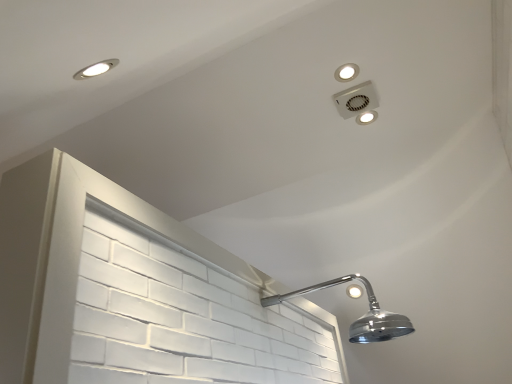
Question: Is matte white light fixture at upper right, the first dot viewed from the right, at the right side of white plastic light fixture at upper center, which is counted as the 2th dot, starting from the back?

Choices:
 (A) yes
 (B) no

Answer: (A)

Question: Is white plastic light fixture at upper center, acting as the 2th dot starting from the right, surrounded by matte white light fixture at upper right, which ranks as the second dot in top-to-bottom order?

Choices:
 (A) no
 (B) yes

Answer: (A)

Question: Is matte white light fixture at upper right, the second dot when ordered from front to back, looking in the opposite direction of white plastic light fixture at upper center, acting as the 2th dot starting from the right?

Choices:
 (A) no
 (B) yes

Answer: (A)

Question: Is matte white light fixture at upper right, the first dot viewed from the right, at the left side of white plastic light fixture at upper center, the first dot viewed from the left?

Choices:
 (A) yes
 (B) no

Answer: (B)

Question: Could you tell me if matte white light fixture at upper right, which ranks as the second dot in top-to-bottom order, is facing white plastic light fixture at upper center, which ranks as the 2th dot in bottom-to-top order?

Choices:
 (A) yes
 (B) no

Answer: (B)

Question: Considering their positions, is white plastic light fixture at upper center, which is the 1th dot in top-to-bottom order, located in front of or behind white plastic vent at upper right?

Choices:
 (A) front
 (B) behind

Answer: (A)

Question: Would you say white plastic light fixture at upper center, which ranks as the 2th dot in bottom-to-top order, is to the left or to the right of white plastic vent at upper right in the picture?

Choices:
 (A) right
 (B) left

Answer: (B)

Question: From the image's perspective, is white plastic light fixture at upper center, which is counted as the 2th dot, starting from the back, above or below white plastic vent at upper right?

Choices:
 (A) above
 (B) below

Answer: (A)

Question: From a real-world perspective, is white plastic light fixture at upper center, which ranks as the 2th dot in bottom-to-top order, positioned above or below white plastic vent at upper right?

Choices:
 (A) below
 (B) above

Answer: (B)

Question: Is matte white light fixture at upper right, the first dot viewed from the right, to the left or to the right of white plastic vent at upper right in the image?

Choices:
 (A) left
 (B) right

Answer: (B)

Question: Is matte white light fixture at upper right, which is counted as the second dot, starting from the left, in front of or behind white plastic vent at upper right in the image?

Choices:
 (A) behind
 (B) front

Answer: (A)

Question: From a real-world perspective, relative to white plastic vent at upper right, is matte white light fixture at upper right, the first dot viewed from the right, vertically above or below?

Choices:
 (A) above
 (B) below

Answer: (A)

Question: Is matte white light fixture at upper right, the first dot viewed from the right, situated inside white plastic vent at upper right or outside?

Choices:
 (A) inside
 (B) outside

Answer: (B)

Question: From a real-world perspective, is white plastic light fixture at upper center, which is counted as the 2th dot, starting from the back, above or below matte white light fixture at upper right, which ranks as the second dot in top-to-bottom order?

Choices:
 (A) above
 (B) below

Answer: (B)

Question: In terms of height, does white plastic light fixture at upper center, the 1th dot in the front-to-back sequence, look taller or shorter compared to matte white light fixture at upper right, the first dot viewed from the right?

Choices:
 (A) tall
 (B) short

Answer: (A)